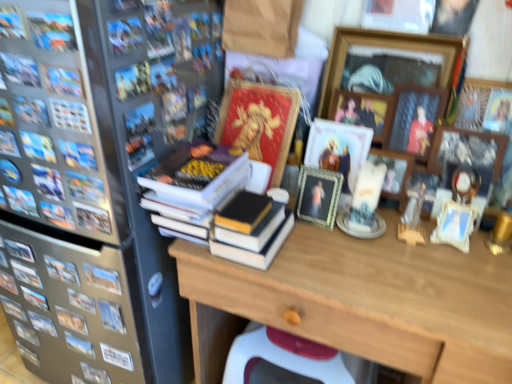
Question: Is point click(314, 173) positioned closer to the camera than point click(352, 105)?

Choices:
 (A) farther
 (B) closer

Answer: (B)

Question: In terms of size, does green textured frame at center, placed as the first picture frame when sorted from left to right, appear bigger or smaller than wooden picture frame at upper center, which is counted as the fourth picture frame, starting from the right?

Choices:
 (A) big
 (B) small

Answer: (B)

Question: Which object is positioned farthest from the matte black book at upper left, which appears as the second book when viewed from the right?

Choices:
 (A) wooden picture frame at upper right, marked as the third picture frame in a right-to-left arrangement
 (B) wooden picture frame at upper center, which is counted as the fourth picture frame, starting from the right
 (C) wooden picture frame at upper right, which is the 1th picture frame from right to left
 (D) hardcover books at center, which is counted as the fourth book, starting from the left
 (E) wooden picture frame at upper right, which is the 2th picture frame from right to left

Answer: (C)

Question: Which object is positioned farthest from the hardcover book at left, placed as the first book when sorted from bottom to top?

Choices:
 (A) green textured frame at center, the fifth picture frame when ordered from right to left
 (B) metallic gray refrigerator at left
 (C) wooden picture frame at upper center, arranged as the second picture frame when viewed from the left
 (D) wooden desk at center
 (E) red matte book at center

Answer: (C)